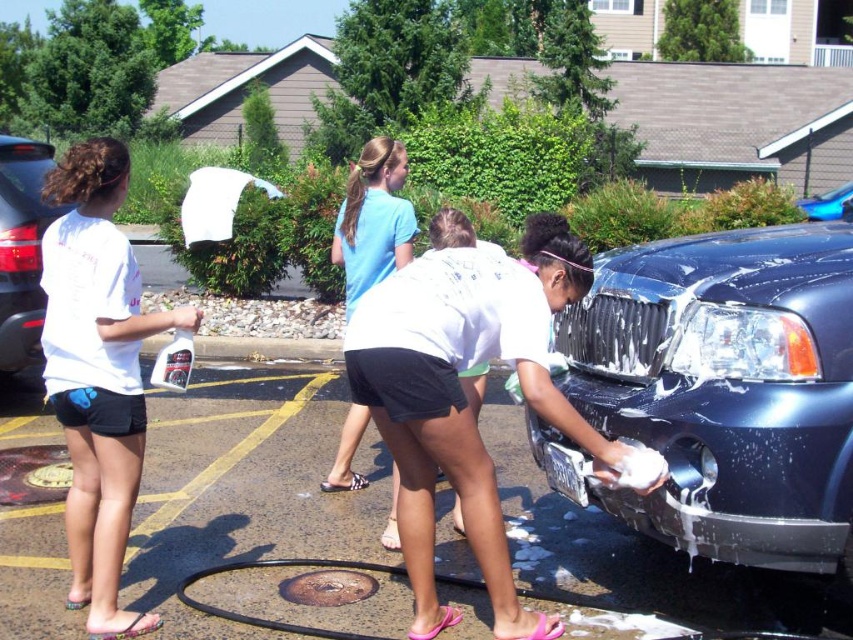
Is glossy black car at lower right to the right of white matte shirt at left from the viewer's perspective?

Indeed, glossy black car at lower right is positioned on the right side of white matte shirt at left.

Does glossy black car at lower right appear under white matte shirt at left?

Incorrect, glossy black car at lower right is not positioned below white matte shirt at left.

The height and width of the screenshot is (640, 853). In order to click on glossy black car at lower right in this screenshot , I will do `click(720, 392)`.

Can you confirm if glossy black car at lower right is positioned to the right of light blue t-shirt at center?

Yes, glossy black car at lower right is to the right of light blue t-shirt at center.

Does glossy black car at lower right have a greater height compared to light blue t-shirt at center?

Correct, glossy black car at lower right is much taller as light blue t-shirt at center.

What do you see at coordinates (720, 392) in the screenshot?
I see `glossy black car at lower right` at bounding box center [720, 392].

I want to click on glossy black car at lower right, so click(x=720, y=392).

Which is in front, point (613, 282) or point (39, 193)?

Positioned in front is point (613, 282).

At what (x,y) coordinates should I click in order to perform the action: click on glossy black car at lower right. Please return your answer as a coordinate pair (x, y). Image resolution: width=853 pixels, height=640 pixels. Looking at the image, I should click on (720, 392).